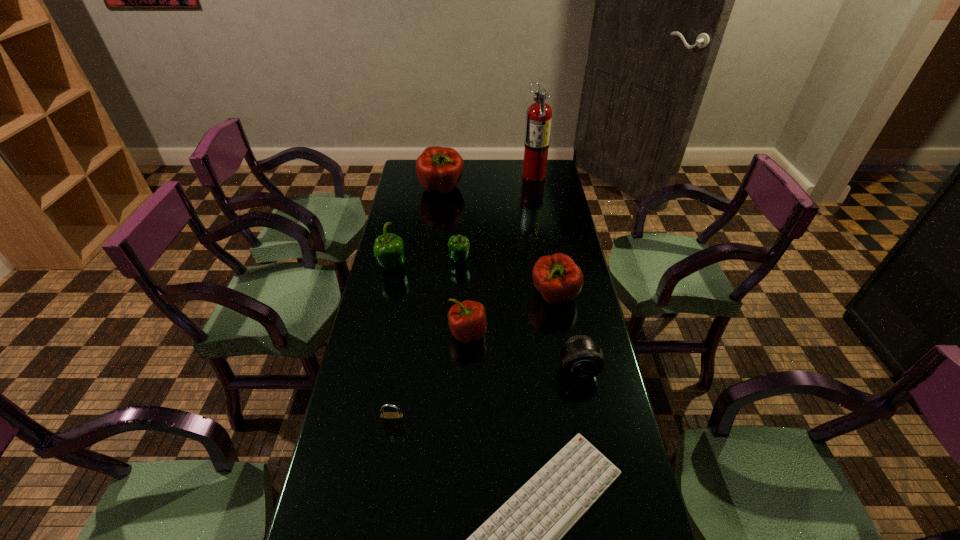
Image resolution: width=960 pixels, height=540 pixels. In order to click on vacant point located 0.160m on the back of the nearest pink bell pepper in this screenshot , I will do `click(468, 285)`.

This screenshot has width=960, height=540. Identify the location of free space located 0.360m on the front-facing side of the telephoto lens. (608, 519).

Image resolution: width=960 pixels, height=540 pixels. In order to click on free space located 0.260m on the front-facing side of the eighth farthest object in this screenshot , I will do `click(376, 536)`.

In order to click on fire extinguisher present at the far edge in this screenshot , I will do `click(539, 114)`.

Identify the location of bell pepper that is at the far edge. (439, 169).

The width and height of the screenshot is (960, 540). I want to click on padlock that is at the left edge, so click(x=389, y=419).

Locate an element on the screen. fire extinguisher located in the right edge section of the desktop is located at coordinates (x=539, y=114).

Find the location of `bell pepper at the right edge`. bell pepper at the right edge is located at coordinates (557, 277).

Find the location of a particular element. This screenshot has height=540, width=960. telephoto lens that is at the right edge is located at coordinates (581, 357).

Identify the location of object that is at the far left corner. This screenshot has width=960, height=540. (439, 169).